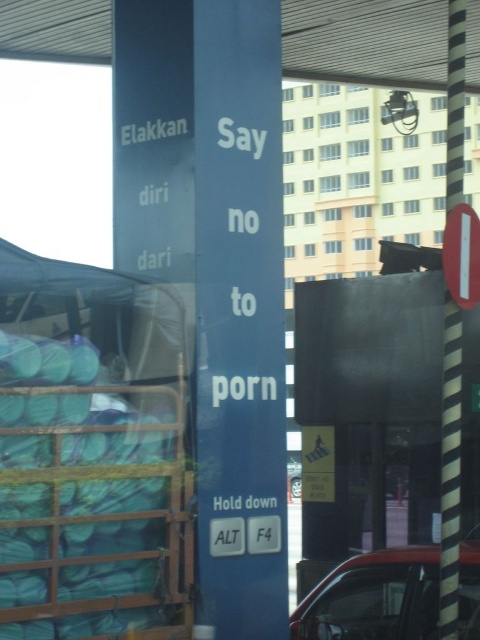
Is red glossy car at lower right closer to the viewer compared to metallic silver car at center?

That is False.

Is red glossy car at lower right to the right of metallic silver car at center from the viewer's perspective?

Correct, you'll find red glossy car at lower right to the right of metallic silver car at center.

Does point (315, 586) come behind point (288, 481)?

No, it is not.

I want to click on red glossy car at lower right, so click(x=373, y=596).